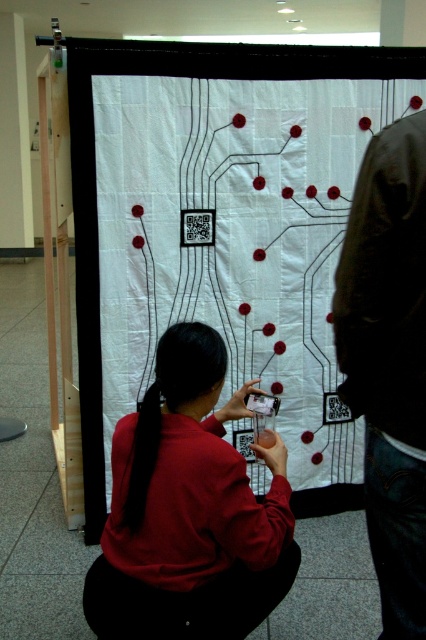
You are a person standing in the scene and want to touch both the dark brown leather jacket at right and the black silky hair at center. What is the minimum distance you need to walk to reach both objects starting from your current position?

The minimum distance you need to walk is 23.11 inches because the dark brown leather jacket at right is 23.11 inches away from the black silky hair at center.